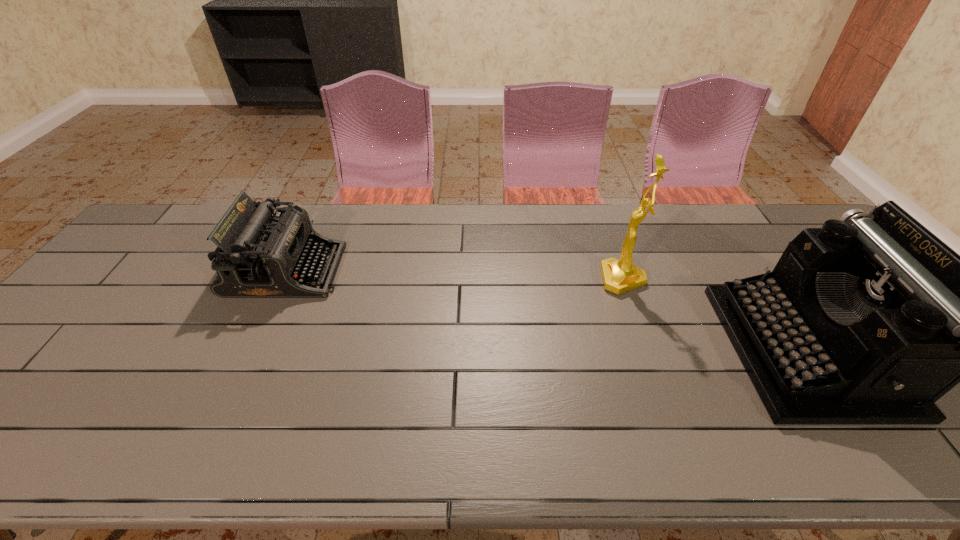
Identify the location of free space between the right typewriter and the award. (714, 314).

Identify the location of free point between the second object from left to right and the taller typewriter. (714, 314).

I want to click on vacant space that is in between the leftmost object and the second object from right to left, so click(x=454, y=275).

Locate an element on the screen. Image resolution: width=960 pixels, height=540 pixels. vacant space that is in between the right typewriter and the award is located at coordinates (714, 314).

The image size is (960, 540). Identify the location of vacant area between the rightmost object and the award. (714, 314).

Locate an element on the screen. free space between the second object from left to right and the second tallest object is located at coordinates (714, 314).

Locate an element on the screen. This screenshot has height=540, width=960. empty location between the second object from left to right and the shortest object is located at coordinates (454, 275).

The width and height of the screenshot is (960, 540). I want to click on vacant region between the award and the left typewriter, so click(x=454, y=275).

I want to click on free point between the second object from right to left and the leftmost object, so click(454, 275).

Choose which object is the nearest neighbor to the second object from right to left. Please provide its 2D coordinates. Your answer should be formatted as a tuple, i.e. [(x, y)], where the tuple contains the x and y coordinates of a point satisfying the conditions above.

[(869, 320)]